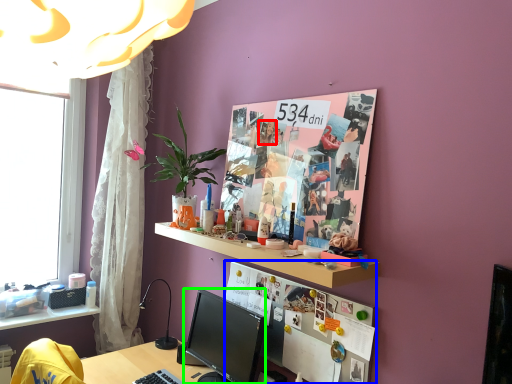
Question: Based on their relative distances, which object is nearer to person (highlighted by a red box)? Choose from bulletin board (highlighted by a blue box) and television (highlighted by a green box).

Choices:
 (A) bulletin board
 (B) television

Answer: (A)